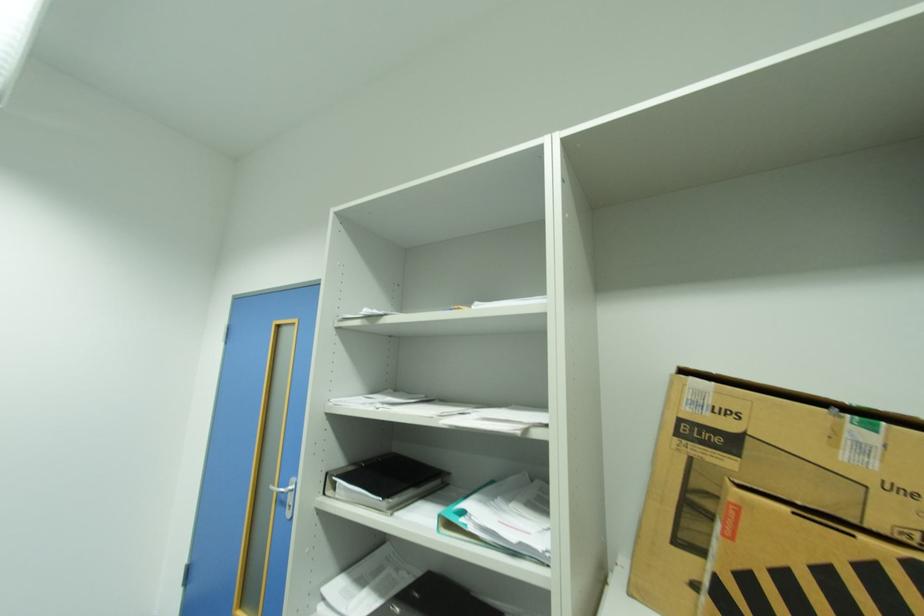
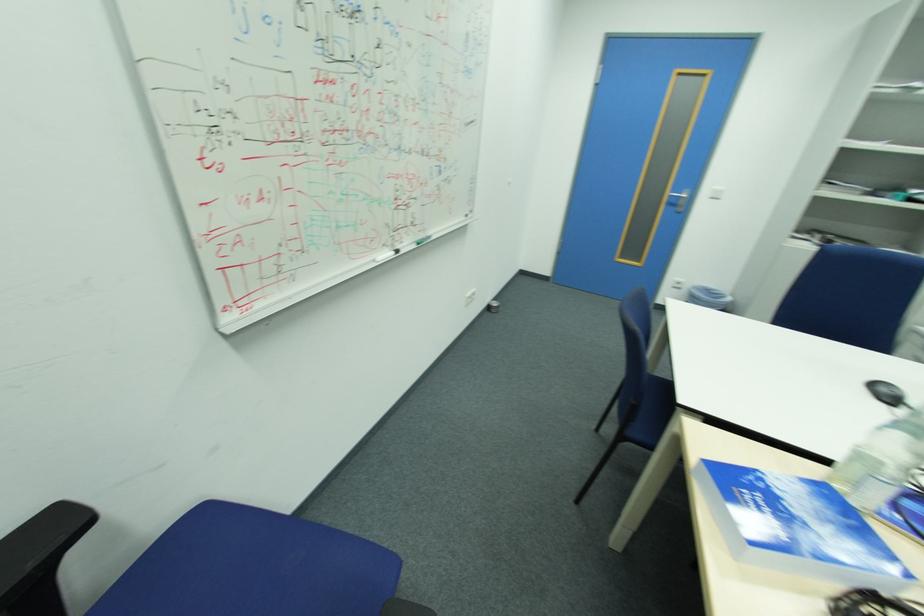
Find the pixel in the second image that matches point 287,498 in the first image.

(678, 203)